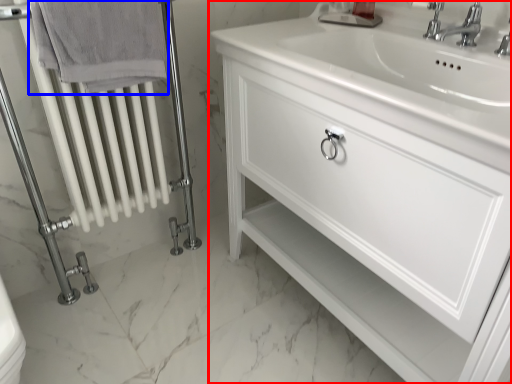
Question: Which point is further to the camera, bathroom cabinet (highlighted by a red box) or bath towel (highlighted by a blue box)?

Choices:
 (A) bathroom cabinet
 (B) bath towel

Answer: (B)